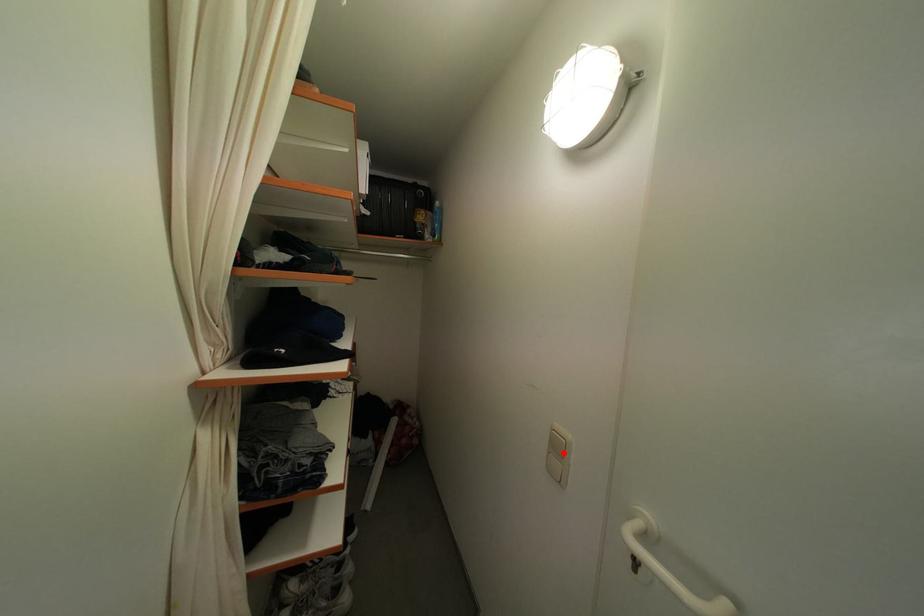
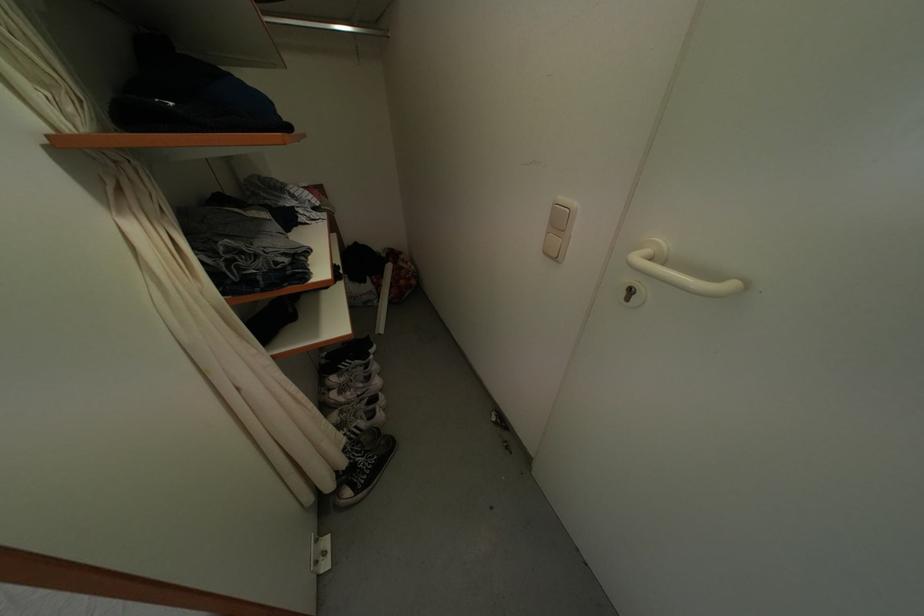
Find the pixel in the second image that matches the highlighted location in the first image.

(565, 228)